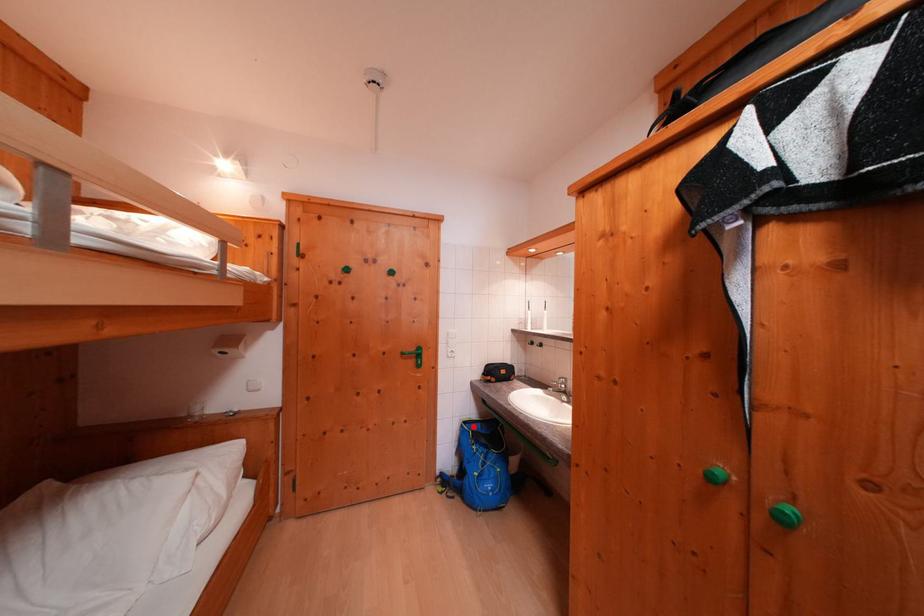
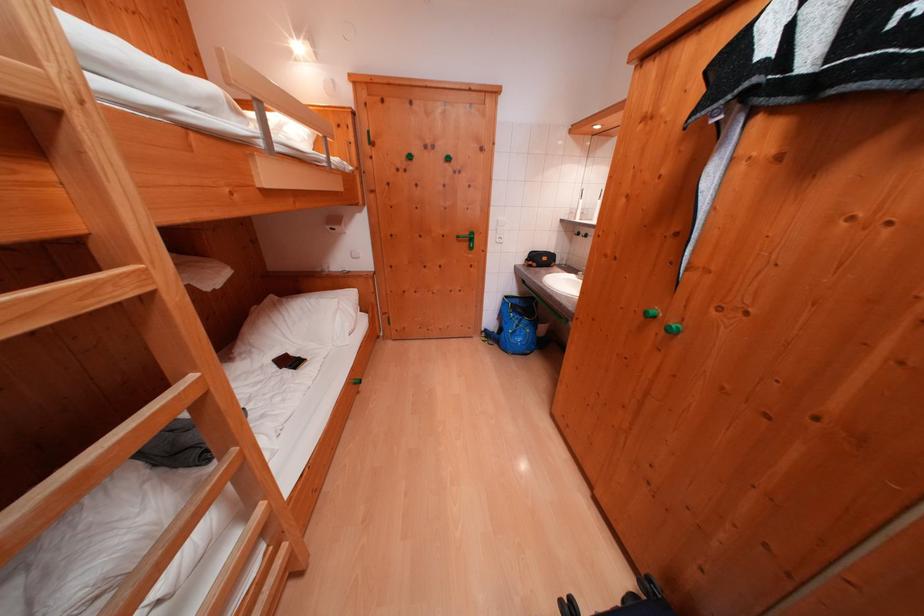
Question: I am providing you with two images of the same scene from different viewpoints. Given a red point in image1, look at the same physical point in image2. Is it:

Choices:
 (A) Closer to the viewpoint
 (B) Farther from the viewpoint

Answer: (A)